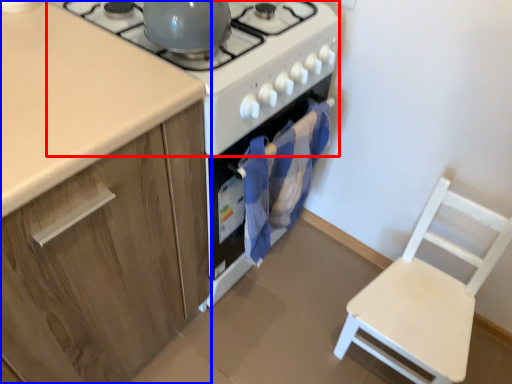
Question: Which of the following is the closest to the observer, gas stove (highlighted by a red box) or cabinetry (highlighted by a blue box)?

Choices:
 (A) gas stove
 (B) cabinetry

Answer: (B)